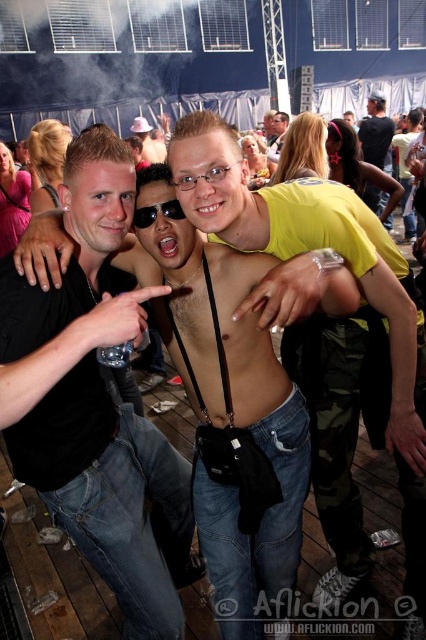
Question: Is black matte shirt at center thinner than shiny black camera at center?

Choices:
 (A) yes
 (B) no

Answer: (A)

Question: Does black matte shirt at center appear over black plastic sunglasses at center?

Choices:
 (A) yes
 (B) no

Answer: (B)

Question: Does shiny black sunglasses at upper right have a larger size compared to black plastic sunglasses at center?

Choices:
 (A) no
 (B) yes

Answer: (B)

Question: Which point appears closest to the camera in this image?

Choices:
 (A) (405, 406)
 (B) (14, 328)
 (C) (138, 209)

Answer: (B)

Question: Which point appears farthest from the camera in this image?

Choices:
 (A) click(367, 186)
 (B) click(154, 579)

Answer: (A)

Question: Which point is closer to the camera?

Choices:
 (A) (275, 141)
 (B) (135, 221)

Answer: (B)